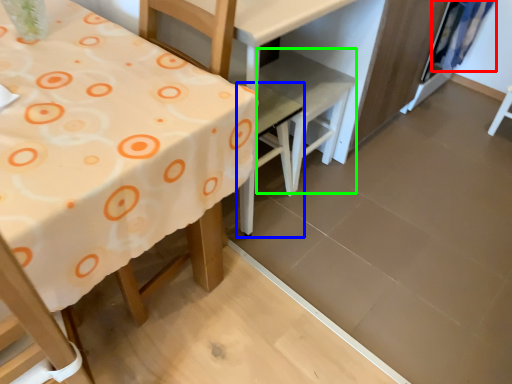
Question: Considering the real-world distances, which object is closest to curtain (highlighted by a red box)? chair (highlighted by a blue box) or chair (highlighted by a green box).

Choices:
 (A) chair
 (B) chair

Answer: (B)